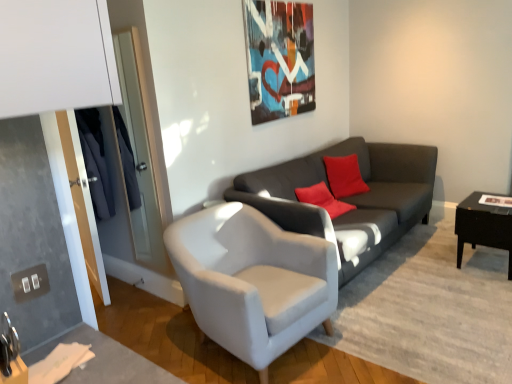
Question: Considering their positions, is white fabric armchair at center located in front of or behind dark gray fabric couch at center?

Choices:
 (A) behind
 (B) front

Answer: (B)

Question: Is point (173, 226) positioned closer to the camera than point (393, 180)?

Choices:
 (A) closer
 (B) farther

Answer: (A)

Question: Which object is the farthest from the white fabric armchair at center?

Choices:
 (A) dark gray fabric couch at center
 (B) black glossy table at right

Answer: (B)

Question: Which is farther from the dark gray fabric couch at center?

Choices:
 (A) white fabric armchair at center
 (B) black glossy table at right

Answer: (B)